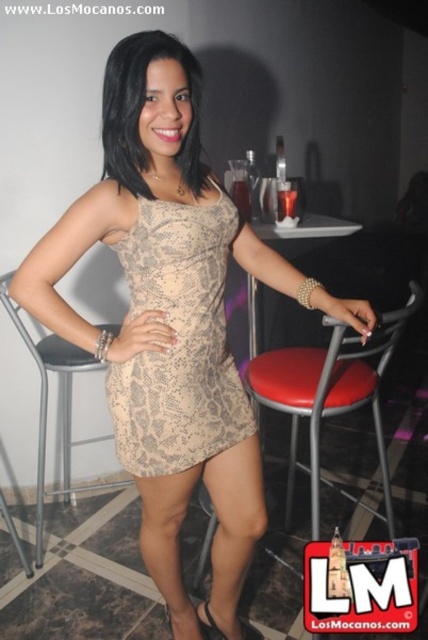
Who is more distant from viewer, (x=184, y=372) or (x=62, y=369)?

Positioned behind is point (x=62, y=369).

Is point (205, 429) closer to viewer compared to point (70, 449)?

Yes, it is.

Identify the location of snake skin beige dress at center. This screenshot has height=640, width=428. (178, 340).

Describe the element at coordinates (326, 394) in the screenshot. This screenshot has height=640, width=428. I see `red leather stool at center` at that location.

Is red leather stool at center bigger than black leather stool at center?

Indeed, red leather stool at center has a larger size compared to black leather stool at center.

Between point (389, 330) and point (17, 323), which one is positioned behind?

The point (17, 323) is behind.

You are a GUI agent. You are given a task and a screenshot of the screen. Output one action in this format:
    pyautogui.click(x=<x>, y=<y>)
    Task: Click on the red leather stool at center
    The height and width of the screenshot is (640, 428).
    Given the screenshot: What is the action you would take?
    pyautogui.click(x=326, y=394)

Is snake skin beige dress at center further to the viewer compared to red leather stool at center?

No, it is in front of red leather stool at center.

In order to click on snake skin beige dress at center in this screenshot , I will do `click(178, 340)`.

Locate an element on the screen. This screenshot has width=428, height=640. snake skin beige dress at center is located at coordinates (178, 340).